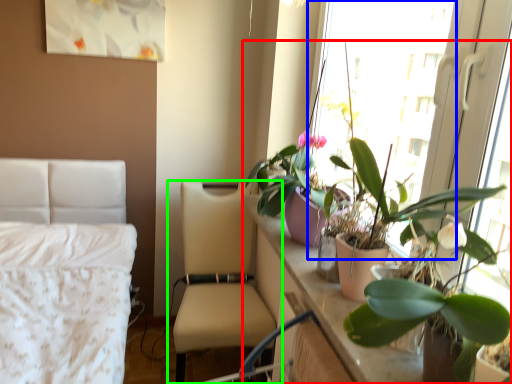
Question: Estimate the real-world distances between objects in this image. Which object is closer to houseplant (highlighted by a red box), window screen (highlighted by a blue box) or chair (highlighted by a green box)?

Choices:
 (A) window screen
 (B) chair

Answer: (A)